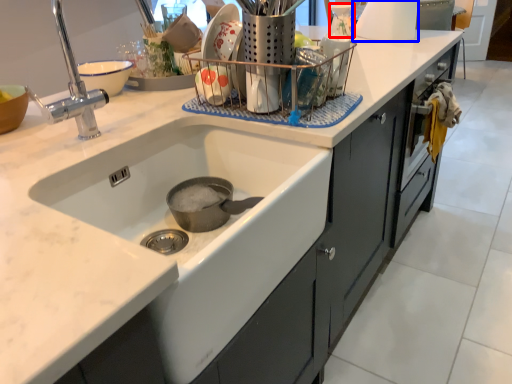
Question: Which object appears farthest to the camera in this image, appliance (highlighted by a red box) or appliance (highlighted by a blue box)?

Choices:
 (A) appliance
 (B) appliance

Answer: (A)